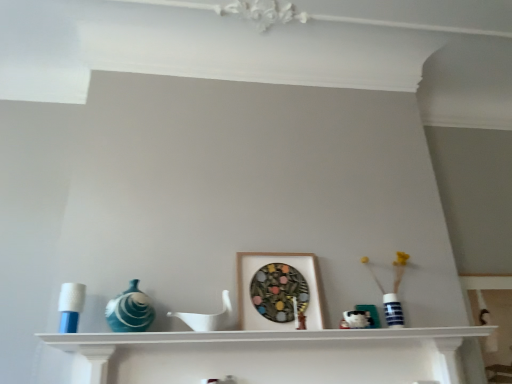
Question: In terms of height, does white matte shelf at center look taller or shorter compared to matte blue glass vase at left?

Choices:
 (A) short
 (B) tall

Answer: (A)

Question: Which is correct: white matte shelf at center is inside matte blue glass vase at left, or outside of it?

Choices:
 (A) outside
 (B) inside

Answer: (A)

Question: Estimate the real-world distances between objects in this image. Which object is closer to the white matte shelf at center?

Choices:
 (A) white glossy ceramic mug at center
 (B) blue plastic candle holder at left
 (C) blue striped vase at right
 (D) matte blue glass vase at left
 (E) wooden picture frame at center

Answer: (E)

Question: Estimate the real-world distances between objects in this image. Which object is farther from the wooden picture frame at center?

Choices:
 (A) blue striped vase at right
 (B) white matte shelf at center
 (C) matte blue glass vase at left
 (D) white glossy ceramic mug at center
 (E) blue plastic candle holder at left

Answer: (E)